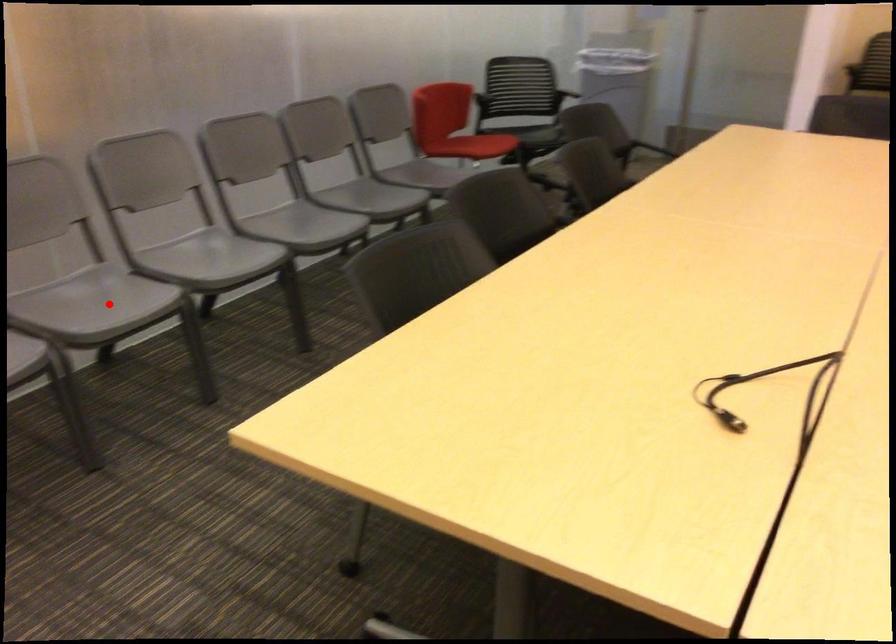
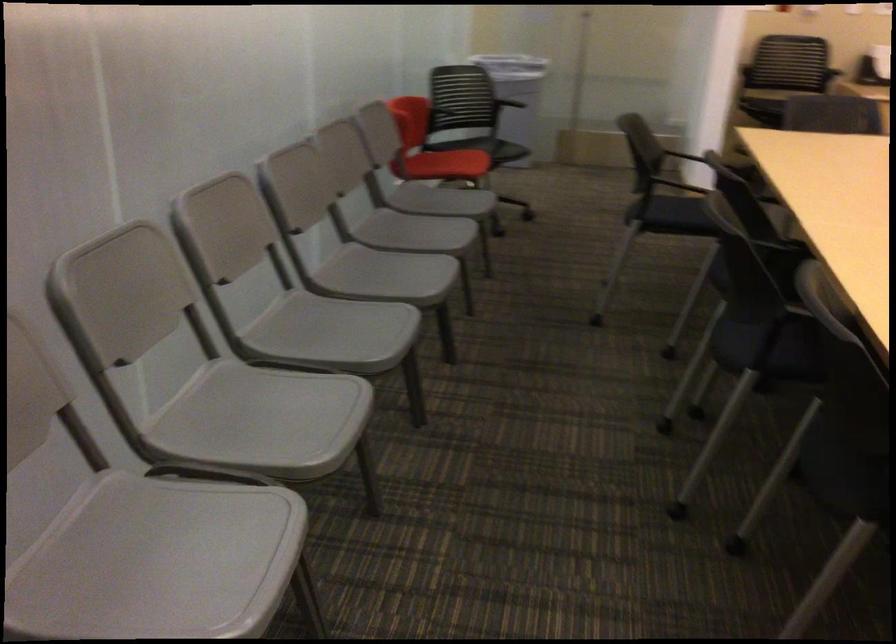
Question: I am providing you with two images of the same scene from different viewpoints. In image1, a red point is highlighted. Considering the same 3D point in image2, which of the following is correct?

Choices:
 (A) It is closer
 (B) It is farther

Answer: (A)